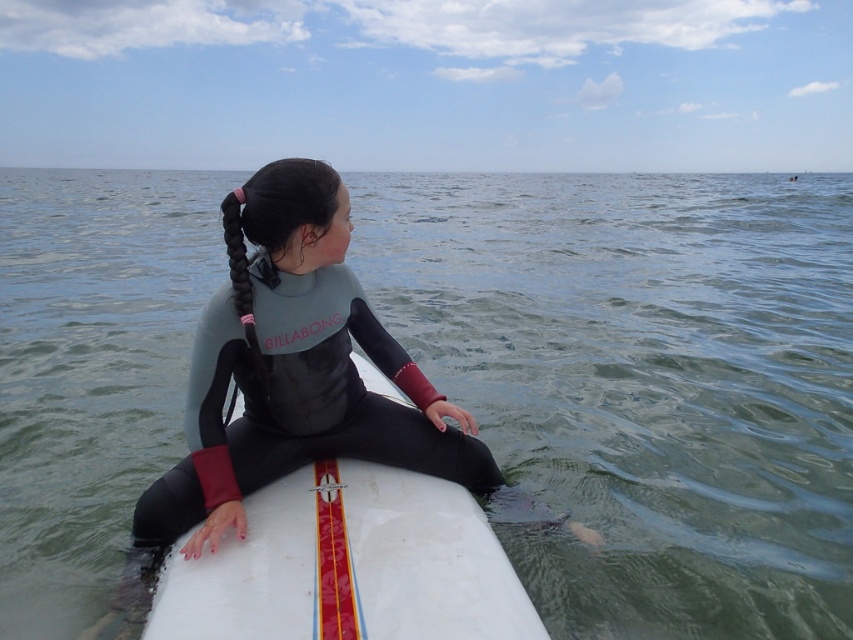
You are a photographer taking a picture of the person on the surfboard. You notice the clear water at surfboard center and the gray matte wetsuit at center. Which object is closer to your camera lens?

The clear water at surfboard center is closer to the camera lens because it is further to the viewer than the gray matte wetsuit at center.

You are a photographer trying to capture the position of the clear water at surfboard center and the white smooth surfboard at center. Based on the scene, which object is located to the left of the other?

The clear water at surfboard center is positioned on the left side of white smooth surfboard at center.